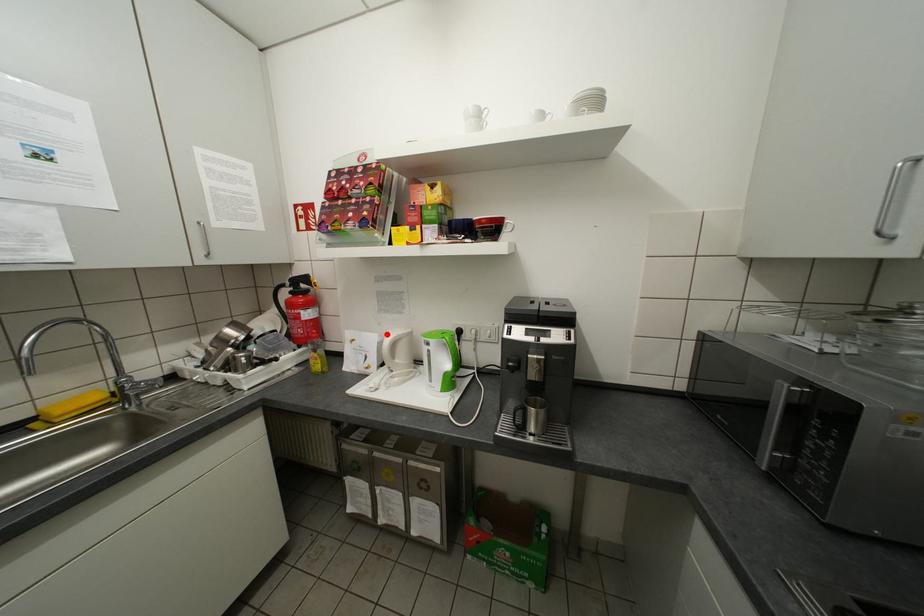
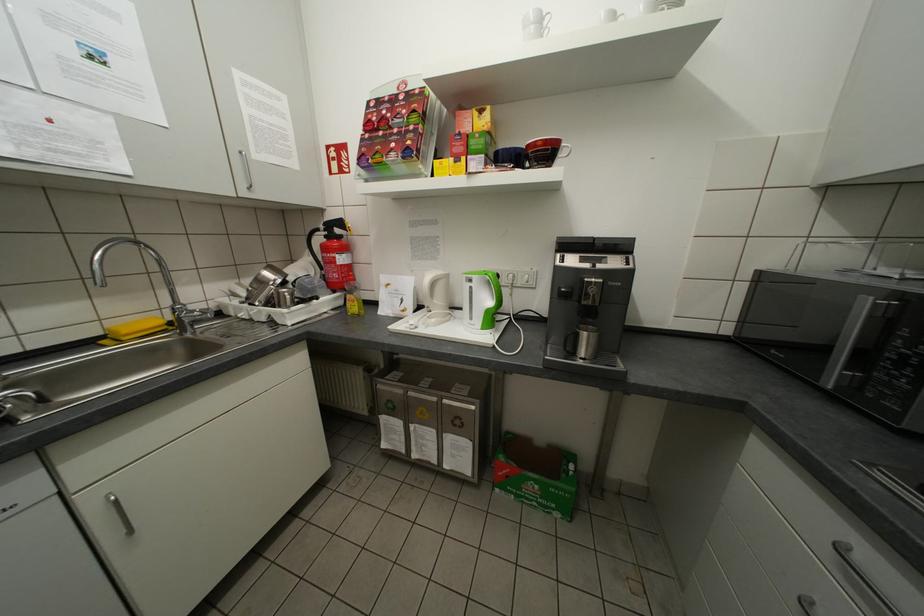
In the second image, find the point that corresponds to the highlighted location in the first image.

(423, 277)